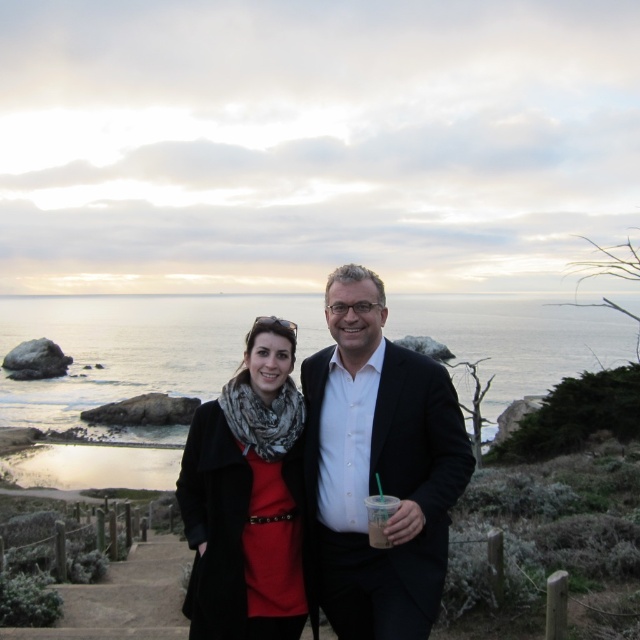
Which is more to the left, clear water at center or matte black coat at center?

matte black coat at center is more to the left.

Between clear water at center and matte black coat at center, which one appears on the right side from the viewer's perspective?

clear water at center

Where is `clear water at center`? The width and height of the screenshot is (640, 640). clear water at center is located at coordinates (138, 348).

The image size is (640, 640). What are the coordinates of `clear water at center` in the screenshot? It's located at pos(138,348).

Is point (228, 566) farther from camera compared to point (376, 516)?

Yes, it is behind point (376, 516).

Locate an element on the screen. Image resolution: width=640 pixels, height=640 pixels. matte black coat at center is located at coordinates click(x=246, y=499).

Find the location of a particular element. The width and height of the screenshot is (640, 640). clear water at center is located at coordinates (138, 348).

Is clear water at center positioned at the back of translucent plastic cup at center?

Yes, clear water at center is further from the viewer.

Is point (96, 472) positioned in front of point (388, 502)?

That is False.

This screenshot has height=640, width=640. Find the location of `clear water at center`. clear water at center is located at coordinates (138, 348).